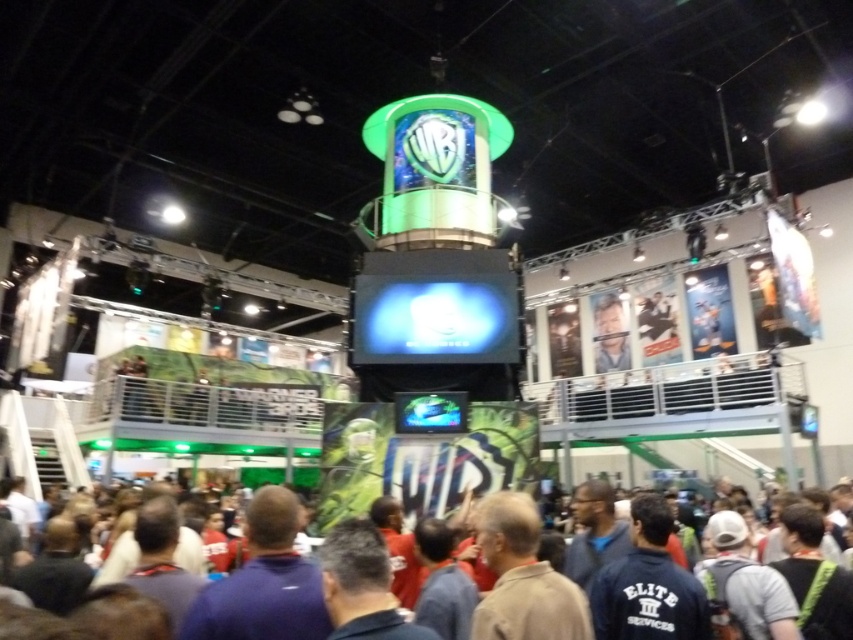
You are at the Warner Bros expo and want to take a photo of the Warner Bros logo on the large cylindrical structure. You have two possible positions to stand at the expo hall, one at point (535, 508) and another at point (592, 316). Which position would allow you to see the logo without any obstruction from the other point?

Point (535, 508) is in front of point (592, 316), so standing at point (535, 508) would allow you to see the Warner Bros logo without obstruction from the other point.

Based on the photo, you are organizing a photo shoot at the Warner Bros expo and need to position two models wearing the brown fabric shirt at lower center and the light blue shirt at center. The minimum distance required between them for the camera setup is 15 meters. Can you confirm if the current spacing between the two shirts meets this requirement?

The brown fabric shirt at lower center and light blue shirt at center are 15.46 meters apart, which exceeds the minimum required distance of 15 meters. Therefore, the current spacing between the two shirts meets the requirement.

You are at the Warner Bros exhibit and notice two people in the crowd. One is wearing a brown fabric shirt at lower center and the other a light blue shirt at center. Which shirt is shorter in length?

The brown fabric shirt at lower center is shorter than the light blue shirt at center.